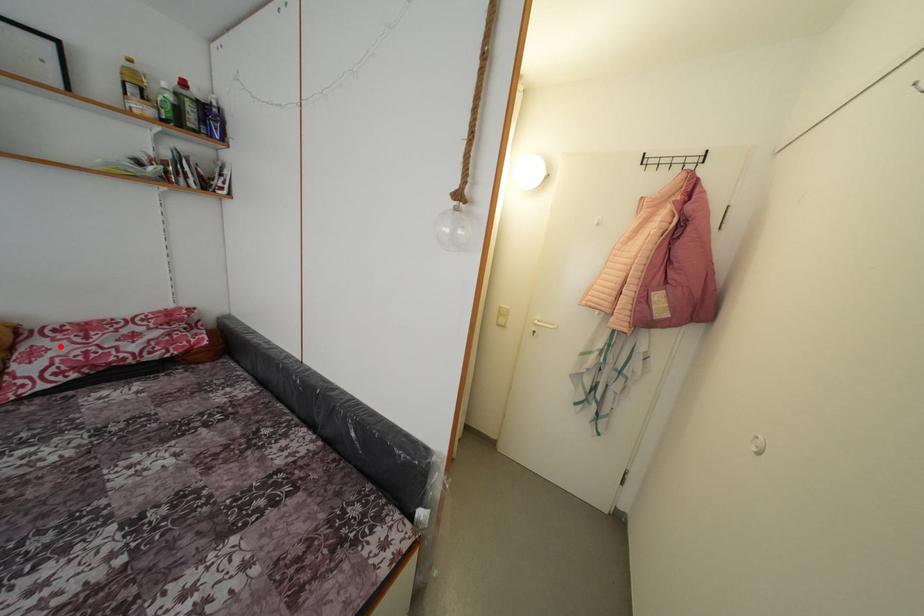
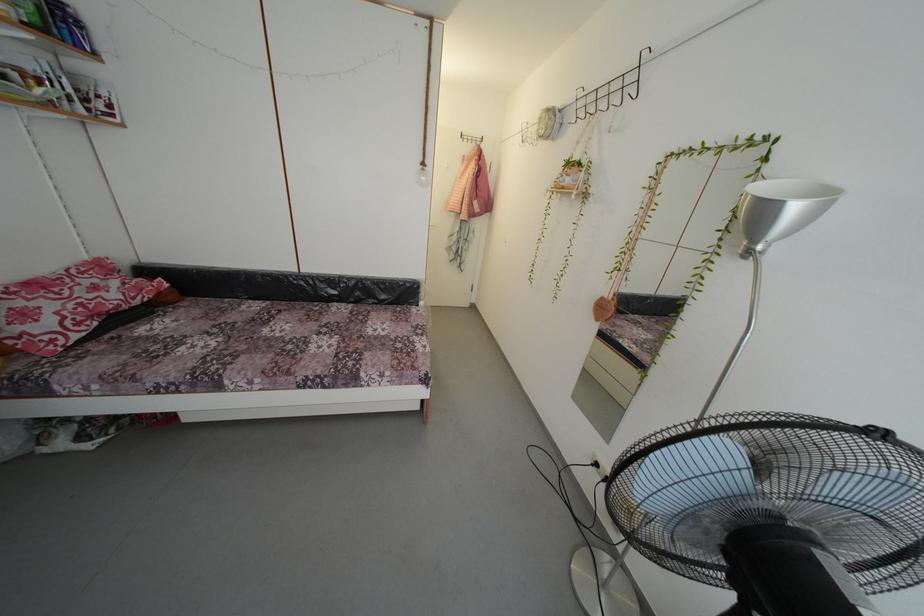
Question: I am providing you with two images of the same scene from different viewpoints. A red point is shown in image1. For the corresponding object point in image2, is it positioned nearer or farther from the camera?

Choices:
 (A) Nearer
 (B) Farther

Answer: (B)